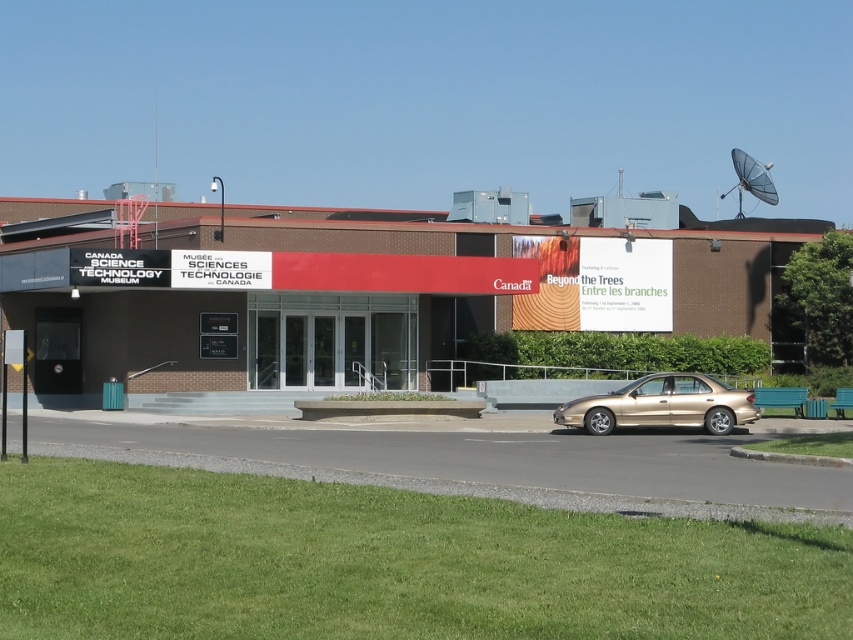
Question: Can you confirm if matte black building at center is wider than gold metallic sedan at lower right?

Choices:
 (A) yes
 (B) no

Answer: (A)

Question: Is matte black building at center to the right of gold metallic sedan at lower right from the viewer's perspective?

Choices:
 (A) no
 (B) yes

Answer: (A)

Question: Does matte black building at center lie in front of gold metallic sedan at lower right?

Choices:
 (A) no
 (B) yes

Answer: (A)

Question: Which object is farther from the camera taking this photo?

Choices:
 (A) matte black building at center
 (B) gold metallic sedan at lower right

Answer: (A)

Question: Among these points, which one is farthest from the camera?

Choices:
 (A) (599, 426)
 (B) (347, 326)

Answer: (B)